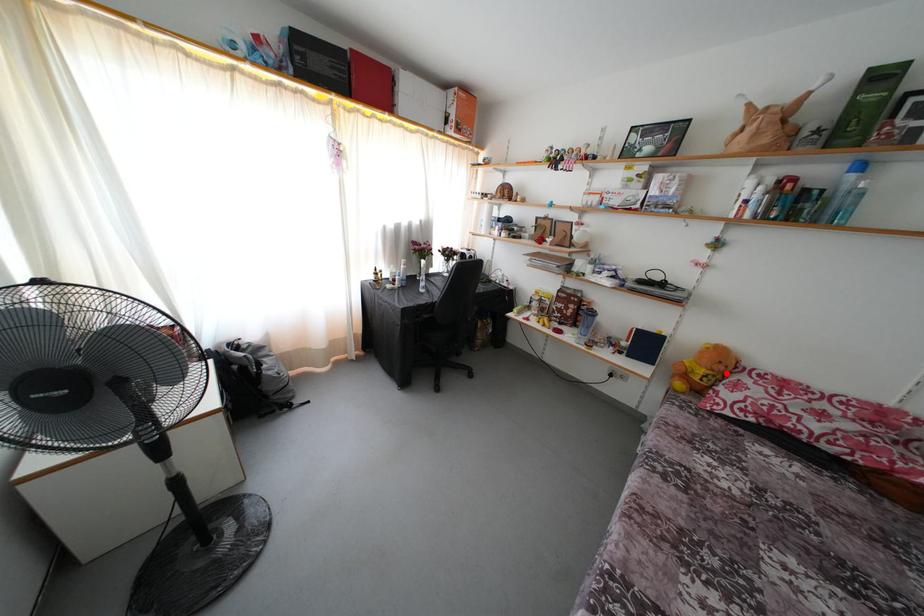
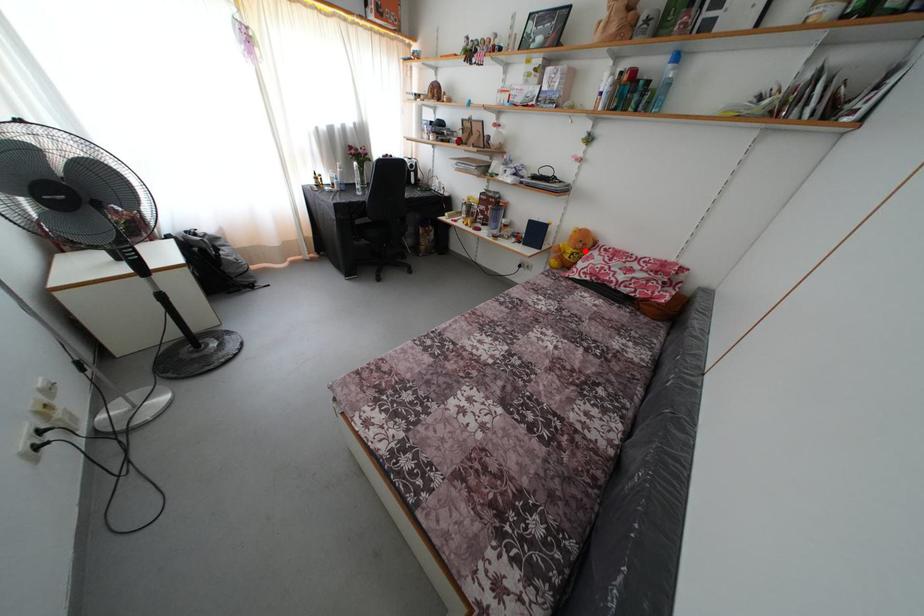
I am providing you with two images of the same scene from different viewpoints. A red point is marked on the first image and another point is marked on the second image. Is the red point in image1 aligned with the point shown in image2?

Yes